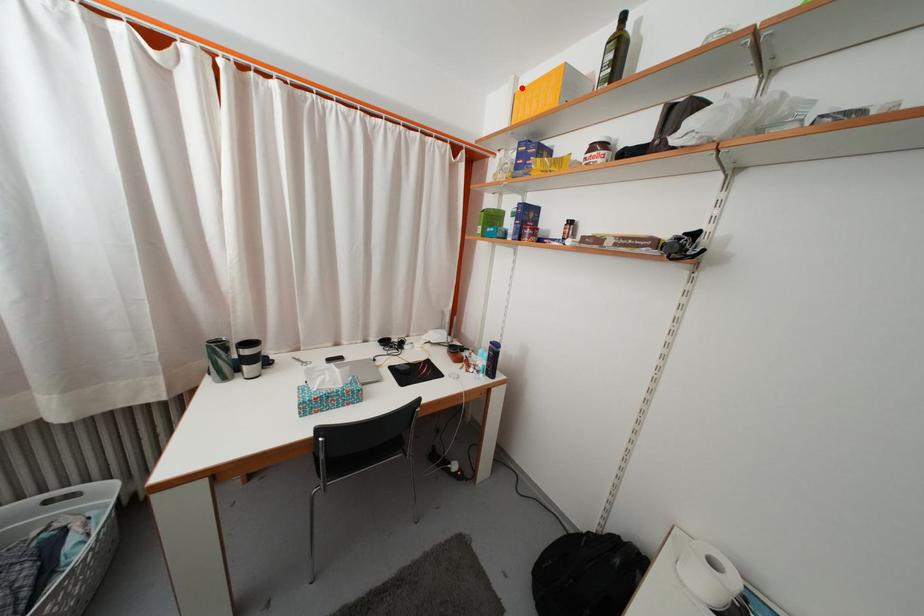
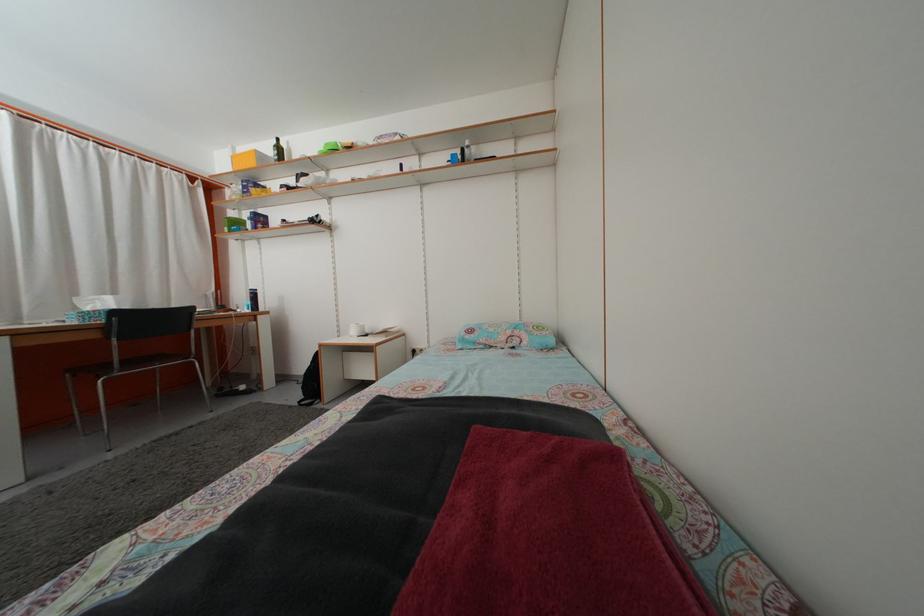
Find the pixel in the second image that matches the highlighted location in the first image.

(239, 156)